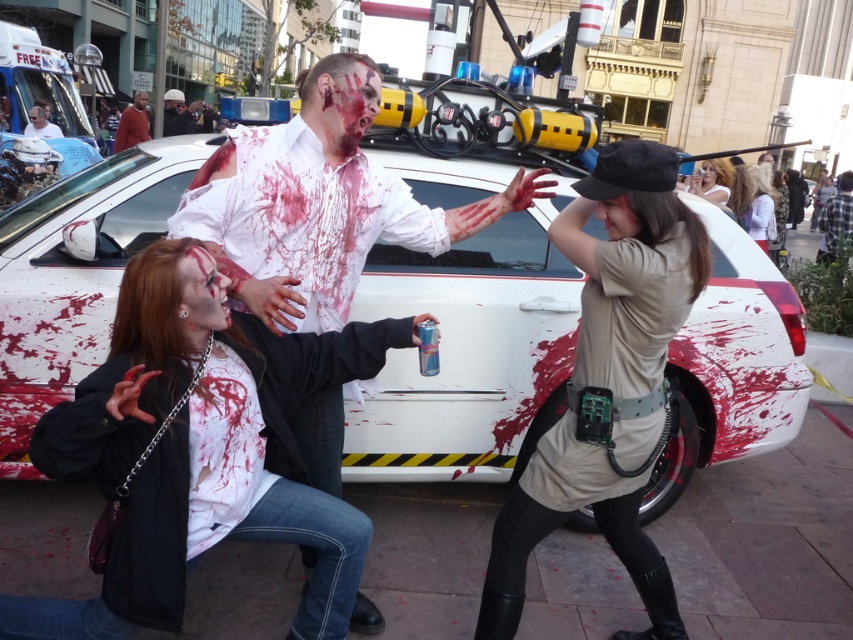
You are a photographer trying to capture a clear shot of the matte black jacket at center without the white plastic ambulance at upper left blocking it. What should you do?

Move your position to the right so the ambulance is no longer in front of the matte black jacket at center.

You are a photographer at the event and need to capture a closeup shot of the matte black jacket at center without the white plastic ambulance at upper left blocking the view. Is the ambulance thin enough to avoid blocking the jacket?

The white plastic ambulance at upper left is thinner than the matte black jacket at center, so it is possible to position the camera such that the ambulance does not block the view of the jacket.

You are a photographer at this event and need to capture a clear shot of both the tan fabric utility belt at lower right and the smooth plastic helmet at upper left. Which object will appear larger in your photo?

The tan fabric utility belt at lower right will appear larger in the photo because it is closer to the viewer than the smooth plastic helmet at upper left.